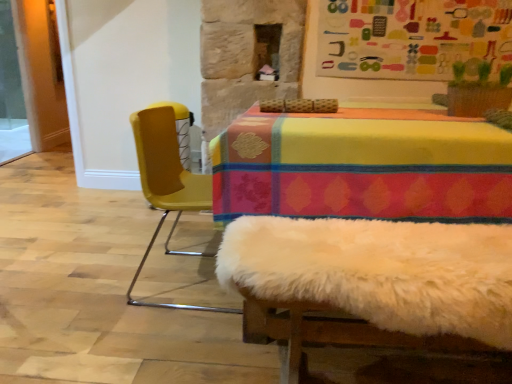
Locate an element on the screen. The image size is (512, 384). vacant space situated on the left part of yellow plastic chair at left is located at coordinates (95, 280).